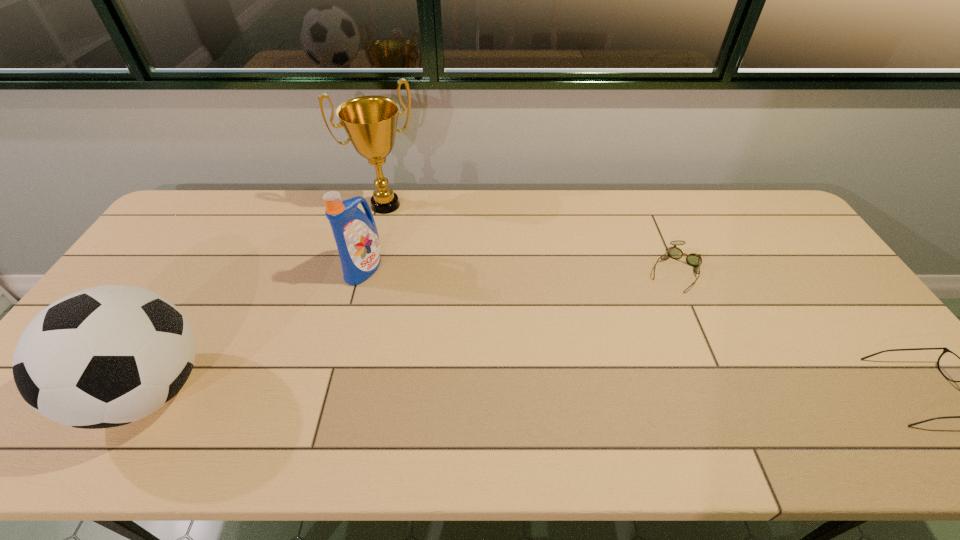
I want to click on free area in between the detergent and the shorter spectacles, so (519, 269).

Locate an element on the screen. vacant area between the leftmost object and the farthest object is located at coordinates (268, 298).

The image size is (960, 540). What are the coordinates of `object that is the closest one to the second object from right to left` in the screenshot? It's located at (954, 368).

The width and height of the screenshot is (960, 540). Find the location of `object that stands as the closest to the detergent`. object that stands as the closest to the detergent is located at coordinates (370, 122).